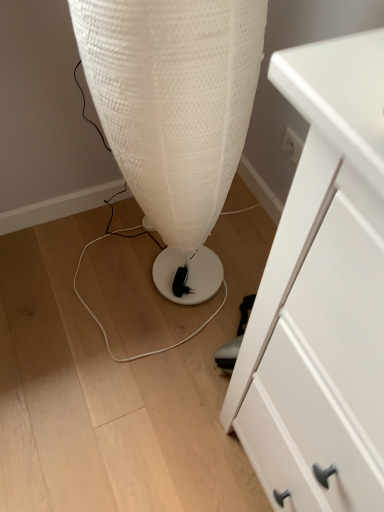
Locate an element on the screen. This screenshot has height=512, width=384. unoccupied region to the right of white mesh lamp at center is located at coordinates (240, 257).